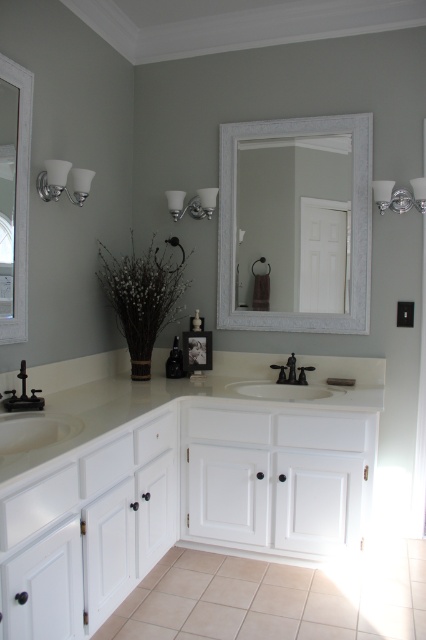
You are a plumber working on the bathroom vanities. You need to place a tool box that is 10 inches wide between the white glossy countertop at center and the matte black faucet at center. Is there enough space for the tool box?

The white glossy countertop at center is 8.39 inches away from the matte black faucet at center. Since the tool box is 10 inches wide, which is wider than the available space, it won t fit between them.

You are a plumber who needs to replace a pipe connecting two faucets in the bathroom. The two faucets are the matte black faucet at center and the black matte faucet at lower left. If the pipe you have is 1.2 meters long, will it be sufficient to connect them?

The distance between the matte black faucet at center and the black matte faucet at lower left is 1.29 meters. Since the pipe is only 1.2 meters long, it is 0.09 meters shorter than required. Therefore, the pipe will not be sufficient to connect them.

You are a bathroom designer planning to place a decorative vase on the white glossy countertop at center. To ensure it doesn not block the reflection in the silver textured mirror at center, where should you position the vase?

The white glossy countertop at center is located below the silver textured mirror at center. To avoid blocking the mirror reflection, position the vase on the countertop away from the area directly under the mirror.